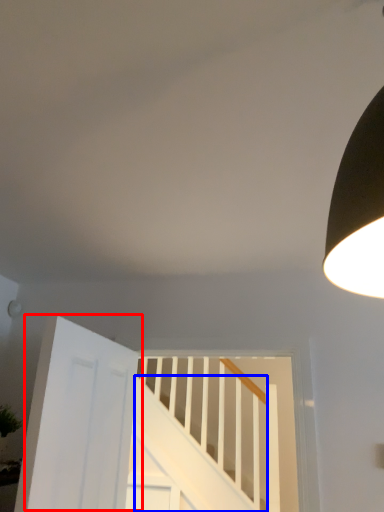
Question: Which point is closer to the camera, door (highlighted by a red box) or stairs (highlighted by a blue box)?

Choices:
 (A) door
 (B) stairs

Answer: (A)